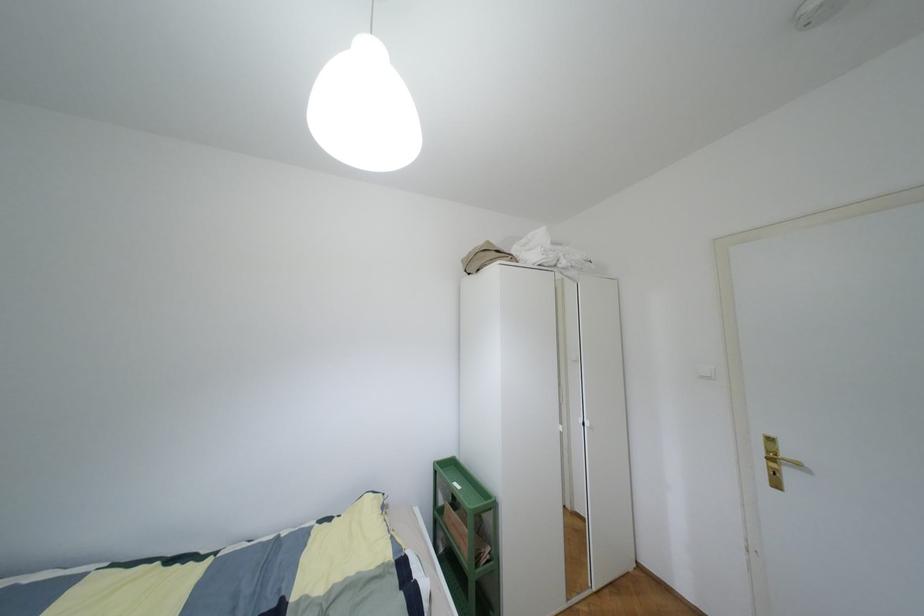
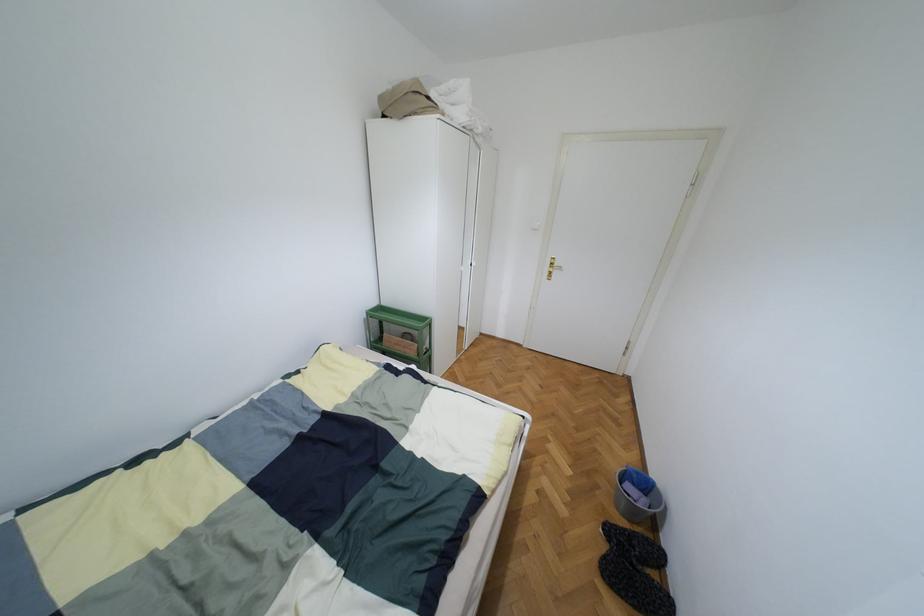
Based on the continuous images, in which direction is the camera rotating?

The rotation direction of the camera is right-down.